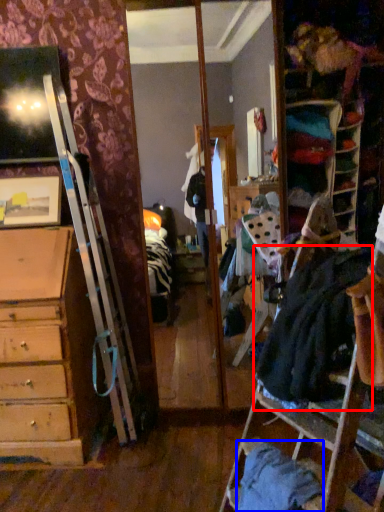
Question: Which of the following is the closest to the observer, clothing (highlighted by a red box) or clothing (highlighted by a blue box)?

Choices:
 (A) clothing
 (B) clothing

Answer: (A)